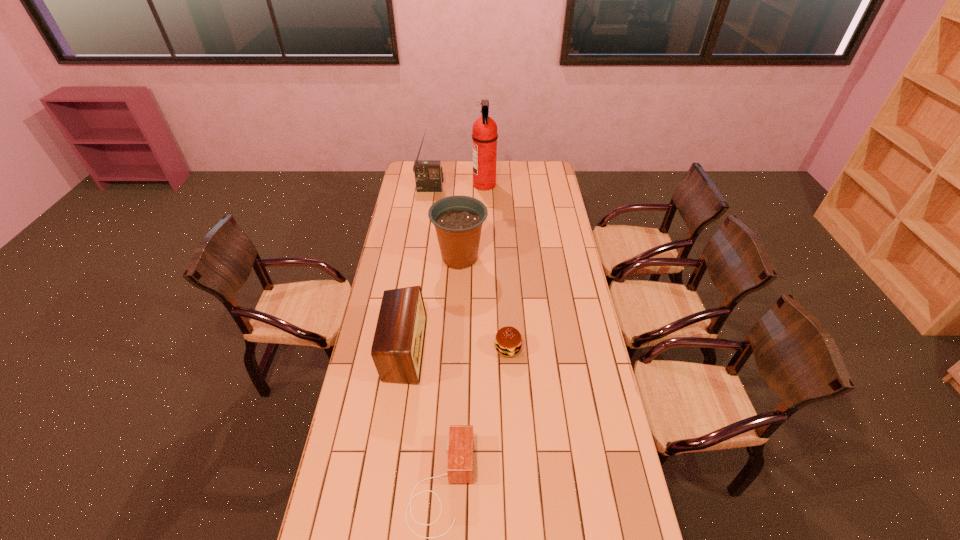
Find the location of `free space at the left edge of the desktop`. free space at the left edge of the desktop is located at coordinates (370, 524).

In the image, there is a desktop. What are the coordinates of `blank space at the right edge` in the screenshot? It's located at (576, 349).

Locate an element on the screen. The image size is (960, 540). vacant region between the hamburger and the second tallest radio receiver is located at coordinates (456, 349).

You are a GUI agent. You are given a task and a screenshot of the screen. Output one action in this format:
    pyautogui.click(x=<x>, y=<y>)
    Task: Click on the free area in between the hamburger and the flowerpot
    The width and height of the screenshot is (960, 540).
    Given the screenshot: What is the action you would take?
    pyautogui.click(x=484, y=303)

Identify the location of free space between the hamburger and the tallest radio receiver. The height and width of the screenshot is (540, 960). (469, 269).

Locate an element on the screen. The width and height of the screenshot is (960, 540). free space that is in between the hamburger and the fourth tallest object is located at coordinates (456, 349).

In order to click on empty location between the tallest radio receiver and the shortest radio receiver in this screenshot , I will do `click(436, 337)`.

Locate an element on the screen. This screenshot has height=540, width=960. free space between the hamburger and the shortest radio receiver is located at coordinates tap(474, 416).

Where is `free space between the fourth shortest object and the hamburger`? Image resolution: width=960 pixels, height=540 pixels. free space between the fourth shortest object and the hamburger is located at coordinates (484, 303).

You are a GUI agent. You are given a task and a screenshot of the screen. Output one action in this format:
    pyautogui.click(x=<x>, y=<y>)
    Task: Click on the vacant region between the nearest radio receiver and the tallest radio receiver
    The width and height of the screenshot is (960, 540).
    Given the screenshot: What is the action you would take?
    pyautogui.click(x=436, y=337)